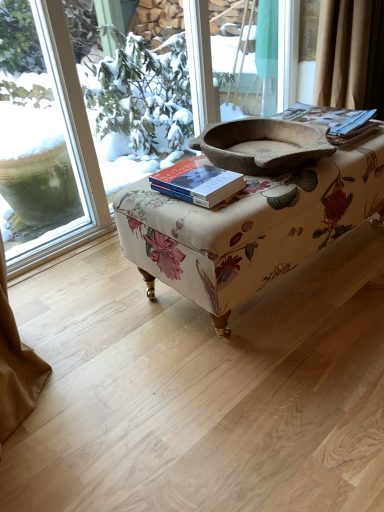
The height and width of the screenshot is (512, 384). Describe the element at coordinates (262, 146) in the screenshot. I see `rustic wooden bowl at center` at that location.

The height and width of the screenshot is (512, 384). Describe the element at coordinates (197, 183) in the screenshot. I see `hardcover book at center, arranged as the 2th paperback book when viewed from the top` at that location.

What do you see at coordinates (334, 121) in the screenshot?
I see `matte brown book at upper right, the 2th paperback book ordered from the bottom` at bounding box center [334, 121].

The image size is (384, 512). What do you see at coordinates (113, 121) in the screenshot?
I see `transparent glass window at upper left` at bounding box center [113, 121].

The height and width of the screenshot is (512, 384). Identify the location of rustic wooden bowl at center. (262, 146).

In the scene shown: From the image's perspective, is hardcover book at center, which is the 2th paperback book in back-to-front order, above or below transparent glass window at upper left?

hardcover book at center, which is the 2th paperback book in back-to-front order, is situated lower than transparent glass window at upper left in the image.

Is hardcover book at center, the second paperback book positioned from the right, positioned far away from transparent glass window at upper left?

hardcover book at center, the second paperback book positioned from the right, is far away from transparent glass window at upper left.

Can you confirm if hardcover book at center, the first paperback book positioned from the left, is positioned to the left of transparent glass window at upper left?

No.

Is hardcover book at center, the first paperback book positioned from the front, facing towards transparent glass window at upper left?

No, hardcover book at center, the first paperback book positioned from the front, is not oriented towards transparent glass window at upper left.

Identify the location of table below the matte brown book at upper right, the 2th paperback book ordered from the bottom (from a real-world perspective). (249, 227).

Does floral fabric ottoman at center have a greater height compared to matte brown book at upper right, which is the 2th paperback book in front-to-back order?

Yes, floral fabric ottoman at center is taller than matte brown book at upper right, which is the 2th paperback book in front-to-back order.

Is there a large distance between floral fabric ottoman at center and matte brown book at upper right, which is the 2th paperback book in left-to-right order?

Actually, floral fabric ottoman at center and matte brown book at upper right, which is the 2th paperback book in left-to-right order, are a little close together.

Could you measure the distance between matte brown book at upper right, the 2th paperback book ordered from the bottom, and floral fabric ottoman at center?

The distance of matte brown book at upper right, the 2th paperback book ordered from the bottom, from floral fabric ottoman at center is 15.31 inches.

Is matte brown book at upper right, acting as the first paperback book starting from the right, aimed at floral fabric ottoman at center?

No.

How different are the orientations of matte brown book at upper right, which is the 2th paperback book in left-to-right order, and floral fabric ottoman at center in degrees?

The angle between the facing direction of matte brown book at upper right, which is the 2th paperback book in left-to-right order, and the facing direction of floral fabric ottoman at center is 4.44 degrees.

Is hardcover book at center, which is the 2th paperback book in back-to-front order, positioned far away from floral fabric ottoman at center?

Actually, hardcover book at center, which is the 2th paperback book in back-to-front order, and floral fabric ottoman at center are a little close together.

Considering the positions of objects hardcover book at center, arranged as the 2th paperback book when viewed from the top, and floral fabric ottoman at center in the image provided, who is more to the right, hardcover book at center, arranged as the 2th paperback book when viewed from the top, or floral fabric ottoman at center?

From the viewer's perspective, floral fabric ottoman at center appears more on the right side.

From a real-world perspective, is hardcover book at center, which is the 2th paperback book in back-to-front order, physically located above or below floral fabric ottoman at center?

In terms of real-world spatial position, hardcover book at center, which is the 2th paperback book in back-to-front order, is above floral fabric ottoman at center.

Find the location of a particular element. Image resolution: width=384 pixels, height=512 pixels. the 1st paperback book directly above the floral fabric ottoman at center (from a real-world perspective) is located at coordinates (197, 183).

Is rustic wooden bowl at center situated inside matte brown book at upper right, which is the 2th paperback book in front-to-back order, or outside?

rustic wooden bowl at center is spatially situated outside matte brown book at upper right, which is the 2th paperback book in front-to-back order.

In the scene shown: How far apart are rustic wooden bowl at center and matte brown book at upper right, acting as the first paperback book starting from the right?

rustic wooden bowl at center and matte brown book at upper right, acting as the first paperback book starting from the right, are 7.31 inches apart.

Based on the photo, can you tell me how much rustic wooden bowl at center and matte brown book at upper right, acting as the 1th paperback book starting from the back, differ in facing direction?

The angular difference between rustic wooden bowl at center and matte brown book at upper right, acting as the 1th paperback book starting from the back, is 5.31 degrees.

Considering the positions of objects rustic wooden bowl at center and matte brown book at upper right, acting as the 1th paperback book starting from the back, in the image provided, who is more to the right, rustic wooden bowl at center or matte brown book at upper right, acting as the 1th paperback book starting from the back,?

matte brown book at upper right, acting as the 1th paperback book starting from the back, is more to the right.

From a real-world perspective, is matte brown book at upper right, the 2th paperback book ordered from the bottom, below rustic wooden bowl at center?

Yes, from a real-world perspective, matte brown book at upper right, the 2th paperback book ordered from the bottom, is beneath rustic wooden bowl at center.

At what (x,y) coordinates should I click in order to perform the action: click on paperback book behind the rustic wooden bowl at center. Please return your answer as a coordinate pair (x, y). Looking at the image, I should click on (334, 121).

Which is correct: matte brown book at upper right, which is the 2th paperback book in left-to-right order, is inside rustic wooden bowl at center, or outside of it?

matte brown book at upper right, which is the 2th paperback book in left-to-right order, cannot be found inside rustic wooden bowl at center.

Does matte brown book at upper right, the 2th paperback book ordered from the bottom, have a greater height compared to rustic wooden bowl at center?

No.

Can you confirm if transparent glass window at upper left is taller than hardcover book at center, which appears as the 1th paperback book when ordered from the bottom?

Indeed, transparent glass window at upper left has a greater height compared to hardcover book at center, which appears as the 1th paperback book when ordered from the bottom.

Is transparent glass window at upper left looking in the opposite direction of hardcover book at center, arranged as the 2th paperback book when viewed from the top?

No, transparent glass window at upper left's orientation is not away from hardcover book at center, arranged as the 2th paperback book when viewed from the top.

Choose the correct answer: Is transparent glass window at upper left inside hardcover book at center, the first paperback book positioned from the left, or outside it?

transparent glass window at upper left is not inside hardcover book at center, the first paperback book positioned from the left, it's outside.

The width and height of the screenshot is (384, 512). Find the location of `paperback book that is in front of the transparent glass window at upper left`. paperback book that is in front of the transparent glass window at upper left is located at coordinates point(197,183).

Which paperback book is the 2nd one when counting from the back of the floral fabric ottoman at center? Please provide its 2D coordinates.

[(334, 121)]

Consider the image. Which object lies nearer to the anchor point rustic wooden bowl at center, floral fabric ottoman at center or transparent glass window at upper left?

Among the two, floral fabric ottoman at center is located nearer to rustic wooden bowl at center.

Considering their positions, is matte brown book at upper right, acting as the 1th paperback book starting from the back, positioned closer to hardcover book at center, the first paperback book positioned from the left, than transparent glass window at upper left?

matte brown book at upper right, acting as the 1th paperback book starting from the back, is positioned closer to the anchor hardcover book at center, the first paperback book positioned from the left.

When comparing their distances from transparent glass window at upper left, does matte brown book at upper right, acting as the first paperback book starting from the right, or hardcover book at center, the first paperback book positioned from the left, seem further?

The object further to transparent glass window at upper left is hardcover book at center, the first paperback book positioned from the left.

Considering their positions, is transparent glass window at upper left positioned further to rustic wooden bowl at center than hardcover book at center, which is the 2th paperback book in back-to-front order?

Based on the image, transparent glass window at upper left appears to be further to rustic wooden bowl at center.

Based on their spatial positions, is hardcover book at center, the first paperback book positioned from the front, or floral fabric ottoman at center further from matte brown book at upper right, which is the 2th paperback book in front-to-back order?

The object further to matte brown book at upper right, which is the 2th paperback book in front-to-back order, is hardcover book at center, the first paperback book positioned from the front.

Which object lies nearer to the anchor point transparent glass window at upper left, hardcover book at center, which is the 2th paperback book in back-to-front order, or floral fabric ottoman at center?

Based on the image, floral fabric ottoman at center appears to be nearer to transparent glass window at upper left.

Looking at the image, which one is located further to matte brown book at upper right, which is the 2th paperback book in front-to-back order, floral fabric ottoman at center or transparent glass window at upper left?

Based on the image, transparent glass window at upper left appears to be further to matte brown book at upper right, which is the 2th paperback book in front-to-back order.

Considering their positions, is floral fabric ottoman at center positioned further to hardcover book at center, the first paperback book positioned from the front, than rustic wooden bowl at center?

rustic wooden bowl at center is positioned further to the anchor hardcover book at center, the first paperback book positioned from the front.

I want to click on footrest between transparent glass window at upper left and hardcover book at center, arranged as the 2th paperback book when viewed from the top, from top to bottom, so point(262,146).

You are a GUI agent. You are given a task and a screenshot of the screen. Output one action in this format:
    pyautogui.click(x=<x>, y=<y>)
    Task: Click on the footrest between floral fabric ottoman at center and matte brown book at upper right, placed as the first paperback book when sorted from top to bottom, from front to back
    
    Given the screenshot: What is the action you would take?
    pyautogui.click(x=262, y=146)

Where is `footrest between hardcover book at center, arranged as the 2th paperback book when viewed from the top, and floral fabric ottoman at center`? The width and height of the screenshot is (384, 512). footrest between hardcover book at center, arranged as the 2th paperback book when viewed from the top, and floral fabric ottoman at center is located at coordinates (262, 146).

Locate an element on the screen. This screenshot has width=384, height=512. table situated between hardcover book at center, arranged as the 2th paperback book when viewed from the top, and matte brown book at upper right, placed as the first paperback book when sorted from top to bottom, from left to right is located at coordinates (249, 227).